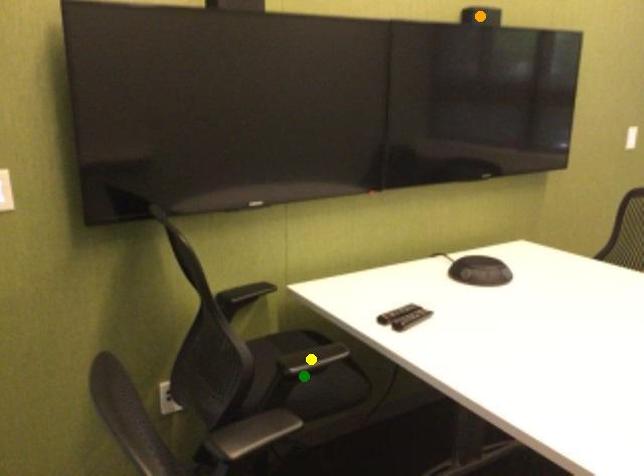
Order these from nearest to farthest:
- orange point
- green point
- yellow point

1. green point
2. yellow point
3. orange point